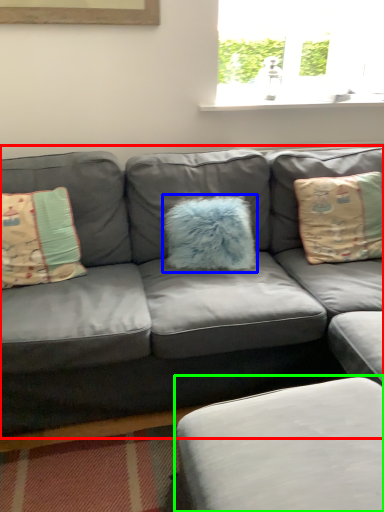
Question: Estimate the real-world distances between objects in this image. Which object is closer to studio couch (highlighted by a red box), pillow (highlighted by a blue box) or footrest (highlighted by a green box)?

Choices:
 (A) pillow
 (B) footrest

Answer: (A)